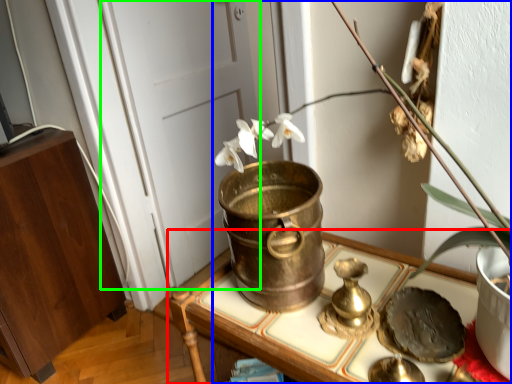
Question: Based on their relative distances, which object is farther from furniture (highlighted by a red box)? Choose from houseplant (highlighted by a blue box) and door (highlighted by a green box).

Choices:
 (A) houseplant
 (B) door

Answer: (B)